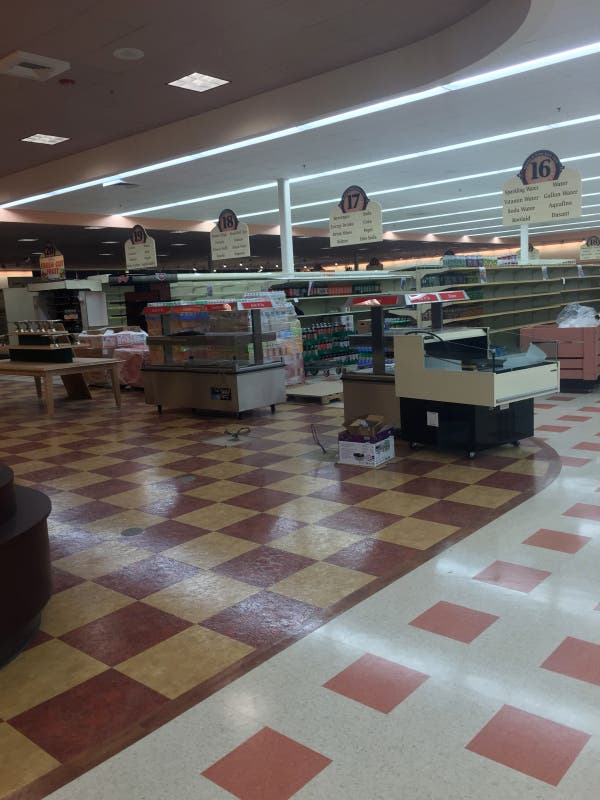
Where is `warmer`? warmer is located at coordinates (215, 342).